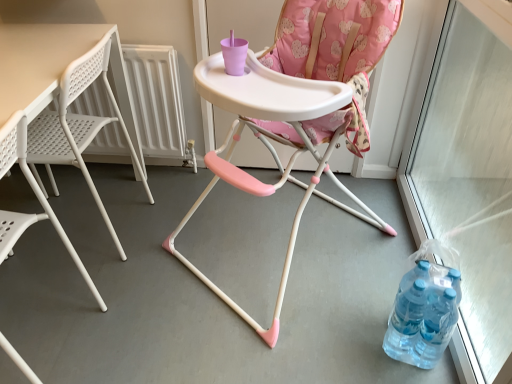
Where is `vacant space behind translucent plastic bottles at lower right`? vacant space behind translucent plastic bottles at lower right is located at coordinates (375, 280).